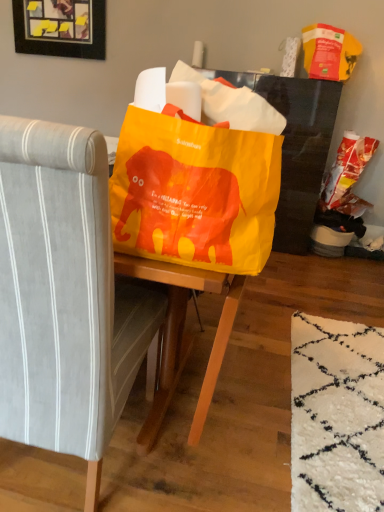
Question: Visually, is yellow plastic grocery bag at upper right, acting as the 2th grocery bag starting from the bottom, positioned to the left or to the right of gray fabric chair at center?

Choices:
 (A) right
 (B) left

Answer: (A)

Question: Is yellow plastic grocery bag at upper right, acting as the 2th grocery bag starting from the bottom, in front of or behind gray fabric chair at center in the image?

Choices:
 (A) front
 (B) behind

Answer: (B)

Question: Which is nearer to the gray fabric chair at center?

Choices:
 (A) wooden frame with yellow sticky notes at upper left
 (B) matte plastic grocery bag at right, which is the first grocery bag in bottom-to-top order
 (C) yellow plastic grocery bag at upper right, acting as the 2th grocery bag starting from the bottom

Answer: (B)

Question: Considering the real-world distances, which object is closest to the gray fabric chair at center?

Choices:
 (A) matte plastic grocery bag at right, placed as the 2th grocery bag when sorted from top to bottom
 (B) wooden frame with yellow sticky notes at upper left
 (C) yellow plastic grocery bag at upper right, arranged as the first grocery bag when viewed from the top

Answer: (A)